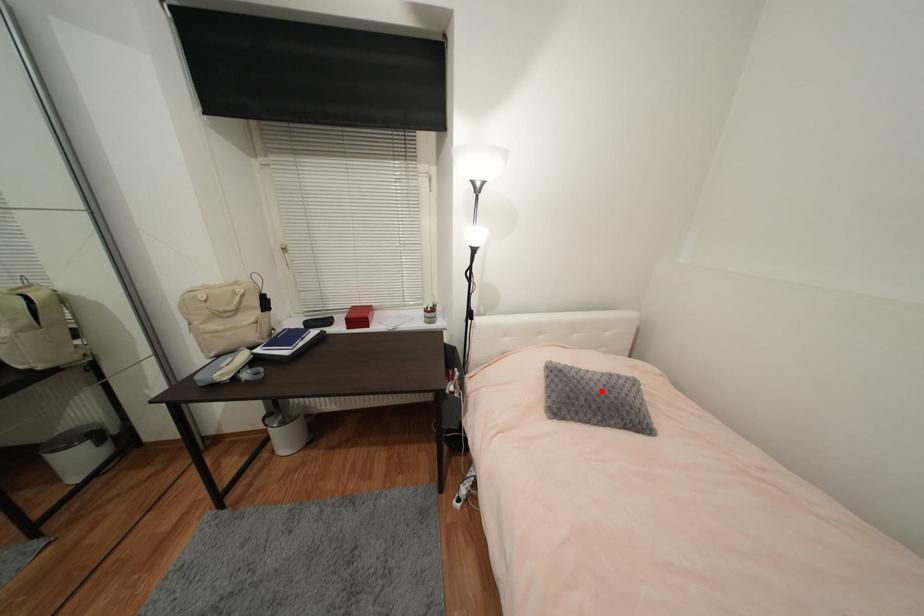
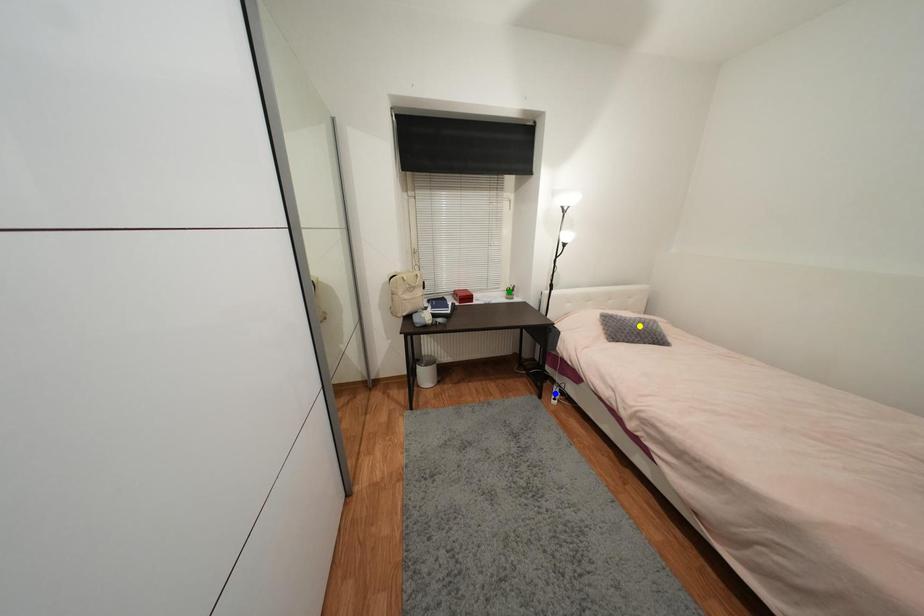
Question: I am providing you with two images of the same scene from different viewpoints. A red point is marked on the first image. You are given multiple points on the second image. Which mark in image 2 goes with the point in image 1?

Choices:
 (A) green point
 (B) blue point
 (C) yellow point

Answer: (C)